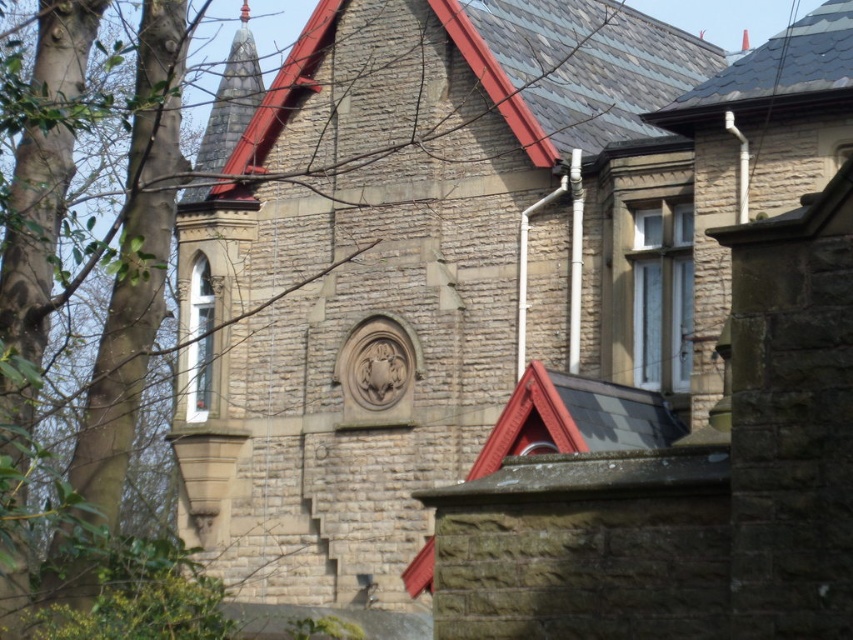
Question: Does gray slate roof at upper center have a lesser width compared to gray slate roof at upper right?

Choices:
 (A) yes
 (B) no

Answer: (B)

Question: Among these objects, which one is farthest from the camera?

Choices:
 (A) gray slate roof at upper center
 (B) gray slate roof at upper right

Answer: (A)

Question: Is gray slate roof at upper center to the right of gray slate roof at upper right from the viewer's perspective?

Choices:
 (A) yes
 (B) no

Answer: (B)

Question: Which of the following is the closest to the observer?

Choices:
 (A) gray slate roof at upper center
 (B) gray slate roof at upper right

Answer: (B)

Question: Is gray slate roof at upper center smaller than gray slate roof at upper right?

Choices:
 (A) no
 (B) yes

Answer: (B)

Question: Which object appears farthest from the camera in this image?

Choices:
 (A) gray slate roof at upper right
 (B) gray slate roof at upper center

Answer: (B)